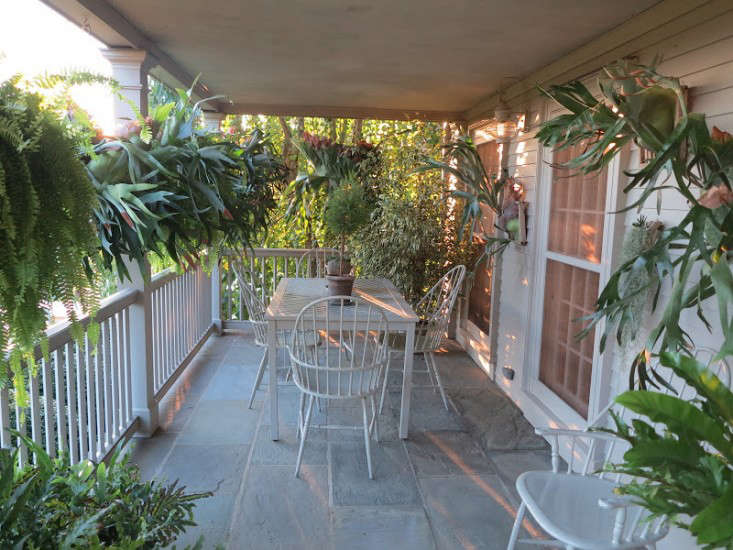
The image size is (733, 550). In order to click on plant vase in this screenshot , I will do `click(339, 282)`.